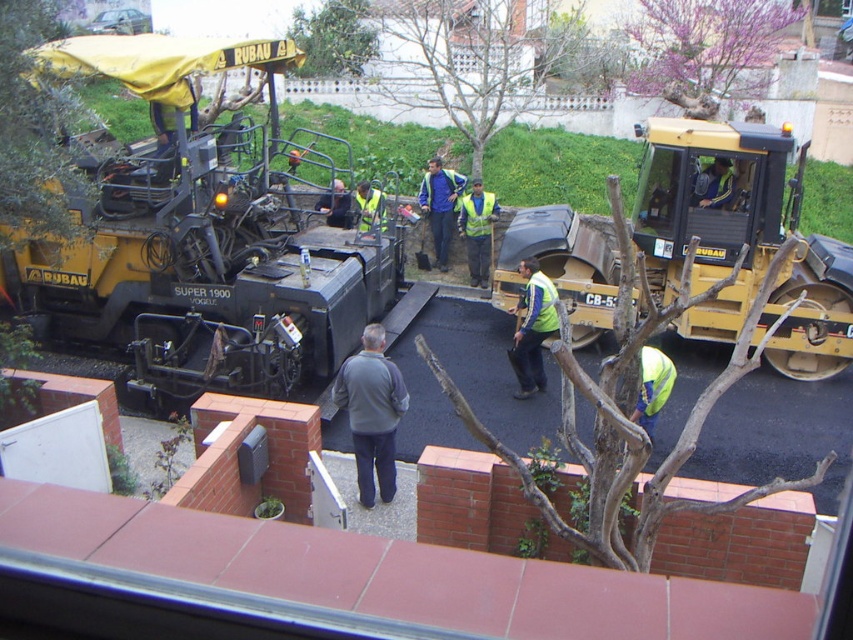
Question: Is the position of gray fleece jacket at center more distant than that of blue fabric jacket at center?

Choices:
 (A) yes
 (B) no

Answer: (B)

Question: Which object appears closest to the camera in this image?

Choices:
 (A) yellow rubber tire compactor at center right
 (B) gray fleece jacket at center
 (C) reflective yellow vest at center
 (D) blue fabric jacket at center

Answer: (B)

Question: Estimate the real-world distances between objects in this image. Which object is farther from the gray fleece jacket at center?

Choices:
 (A) yellow rubber tire compactor at center right
 (B) blue fabric jacket at center
 (C) reflective yellow vest at center

Answer: (B)

Question: Which object appears farthest from the camera in this image?

Choices:
 (A) reflective yellow vest at center
 (B) yellow rubber tire compactor at center right

Answer: (A)

Question: Is gray fleece jacket at center positioned behind reflective yellow vest at center?

Choices:
 (A) no
 (B) yes

Answer: (A)

Question: Is blue fabric jacket at center positioned before reflective yellow vest at center?

Choices:
 (A) yes
 (B) no

Answer: (B)